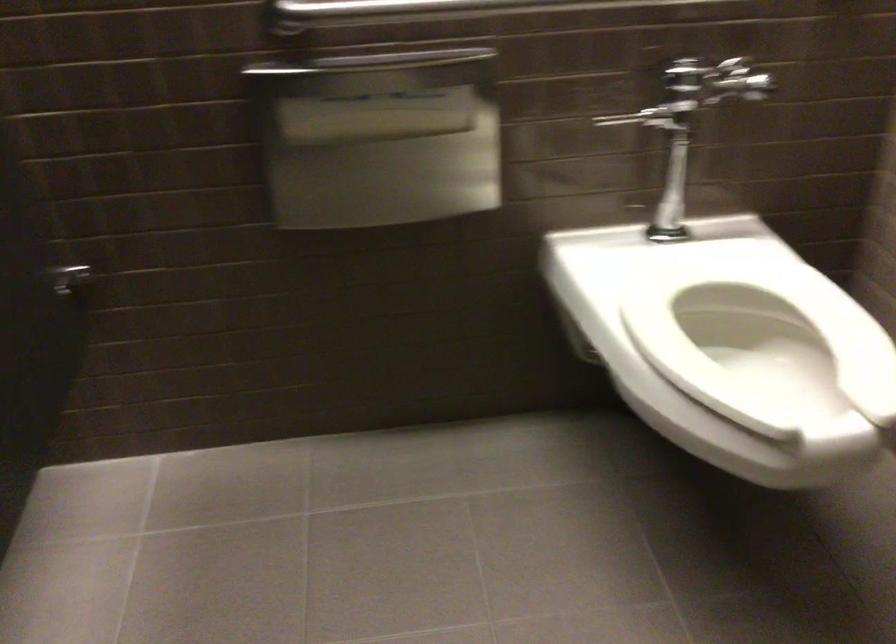
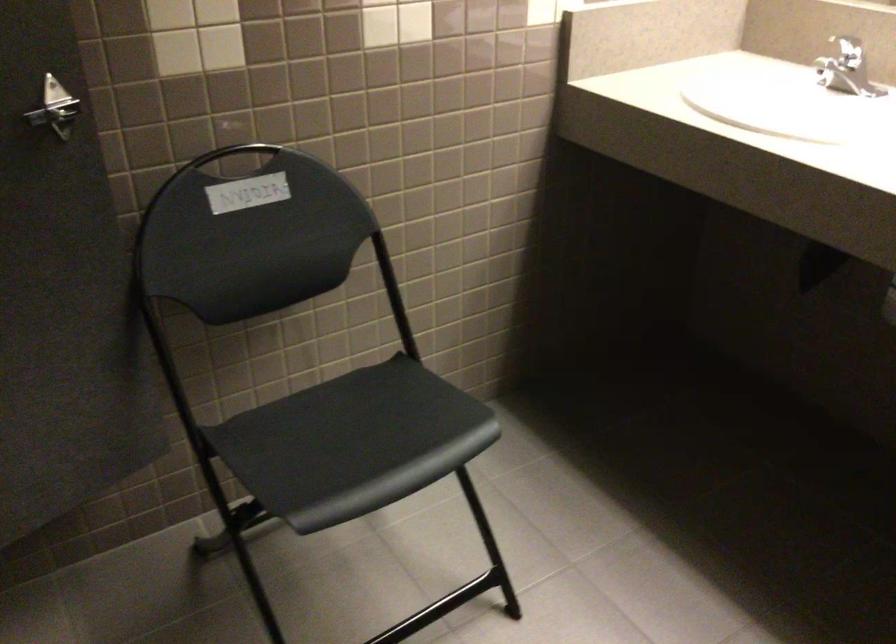
Consider the image. How did the camera likely rotate?

The rotation direction of the camera is right-down.